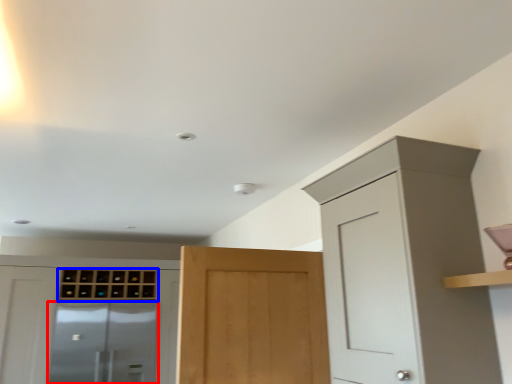
Question: Among these objects, which one is farthest to the camera, screen door (highlighted by a red box) or cabinetry (highlighted by a blue box)?

Choices:
 (A) screen door
 (B) cabinetry

Answer: (B)